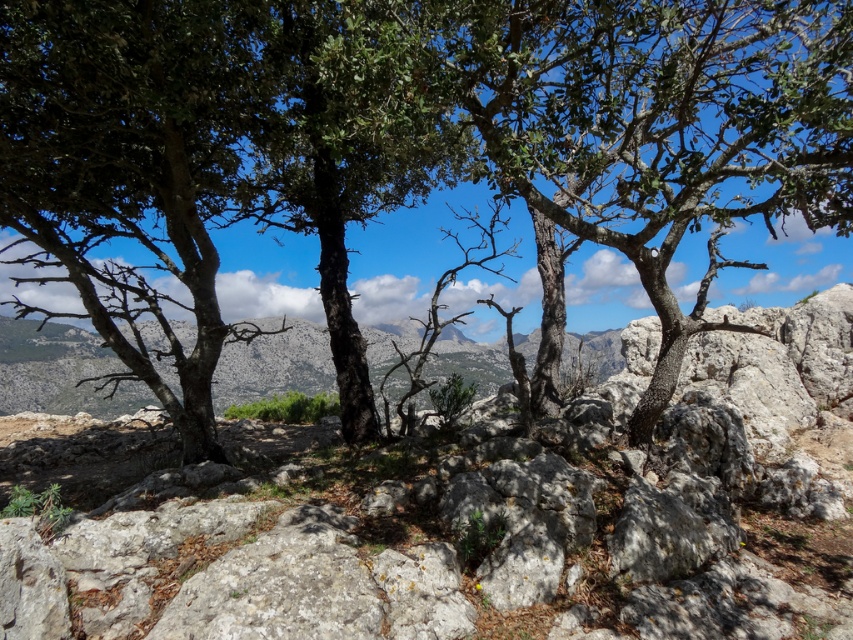
Does point (380, 188) come farther from viewer compared to point (653, 496)?

Yes, point (380, 188) is farther from viewer.

You are a GUI agent. You are given a task and a screenshot of the screen. Output one action in this format:
    pyautogui.click(x=<x>, y=<y>)
    Task: Click on the green leafy tree at center
    The height and width of the screenshot is (640, 853).
    Given the screenshot: What is the action you would take?
    pyautogui.click(x=440, y=124)

Locate an element on the screen. Image resolution: width=853 pixels, height=640 pixels. green leafy tree at center is located at coordinates (440, 124).